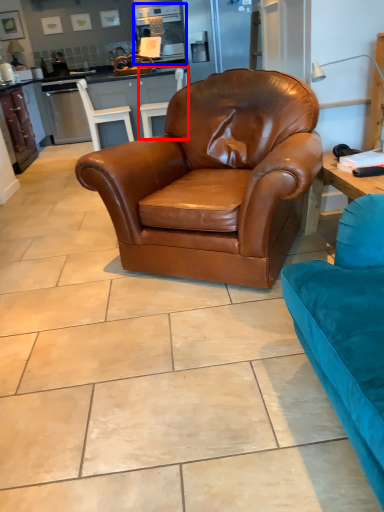
Question: Among these objects, which one is farthest to the camera, chair (highlighted by a red box) or appliance (highlighted by a blue box)?

Choices:
 (A) chair
 (B) appliance

Answer: (B)